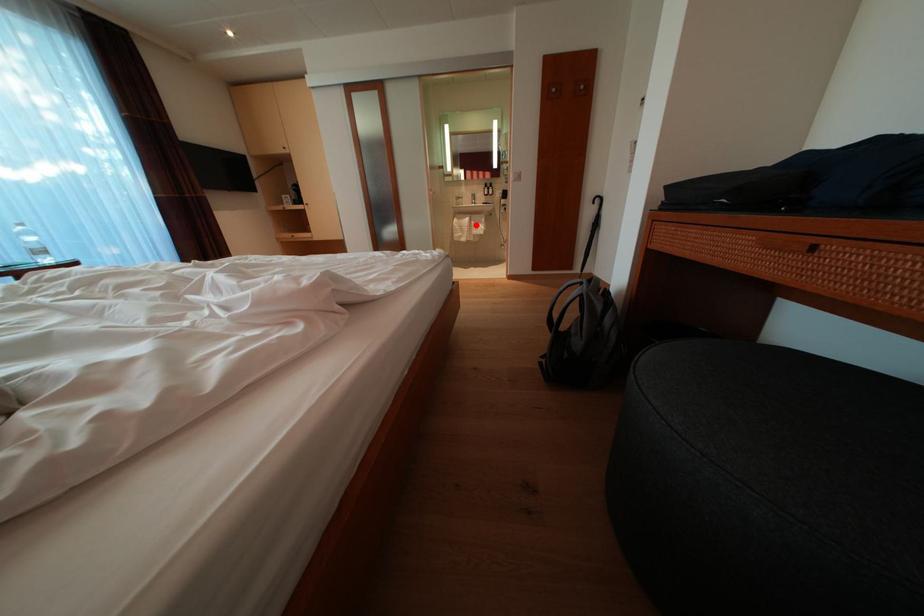
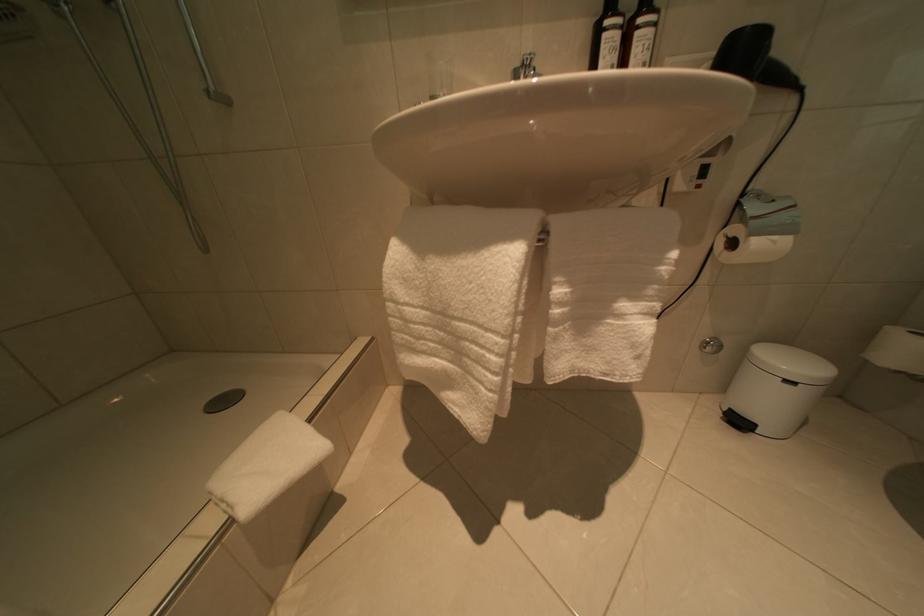
In the second image, find the point that corresponds to the highlighted location in the first image.

(517, 262)